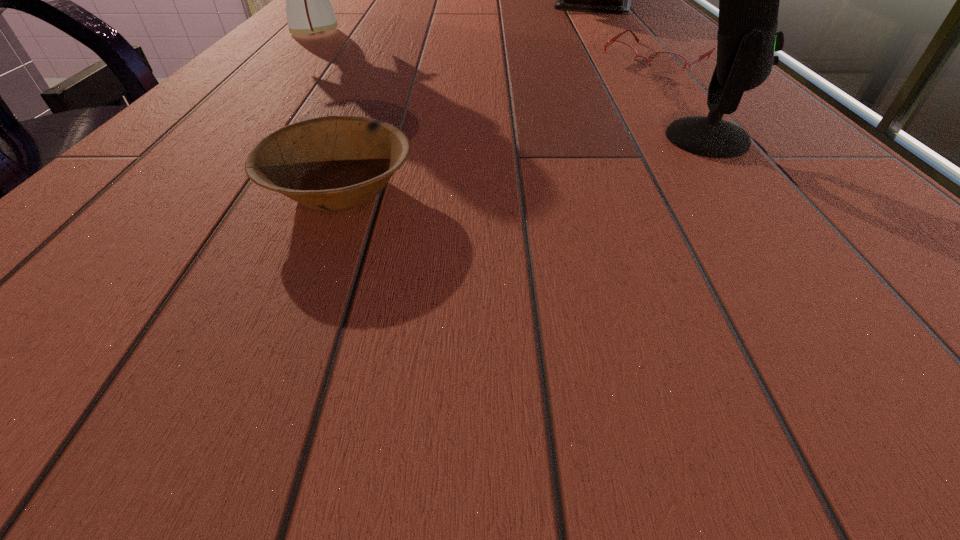
The image size is (960, 540). I want to click on the second shortest object, so click(331, 163).

You are a GUI agent. You are given a task and a screenshot of the screen. Output one action in this format:
    pyautogui.click(x=<x>, y=<y>)
    Task: Click on the bowl
    The width and height of the screenshot is (960, 540).
    Given the screenshot: What is the action you would take?
    pyautogui.click(x=331, y=163)

The height and width of the screenshot is (540, 960). In order to click on microphone in this screenshot , I will do `click(749, 0)`.

Where is `spectacles`? This screenshot has width=960, height=540. spectacles is located at coordinates (665, 64).

You are a GUI agent. You are given a task and a screenshot of the screen. Output one action in this format:
    pyautogui.click(x=<x>, y=<y>)
    Task: Click on the doll
    
    Given the screenshot: What is the action you would take?
    pyautogui.click(x=308, y=8)

Where is `the leftmost object`? The width and height of the screenshot is (960, 540). the leftmost object is located at coordinates (308, 8).

The width and height of the screenshot is (960, 540). Identify the location of free space located on the right of the fourth tallest object. (599, 189).

Where is `free space located 0.140m on the back of the microphone`? free space located 0.140m on the back of the microphone is located at coordinates (665, 85).

Identify the location of free space located on the lenses of the spectacles. (503, 163).

Find the location of `free space located on the lenses of the spectacles`. free space located on the lenses of the spectacles is located at coordinates (516, 154).